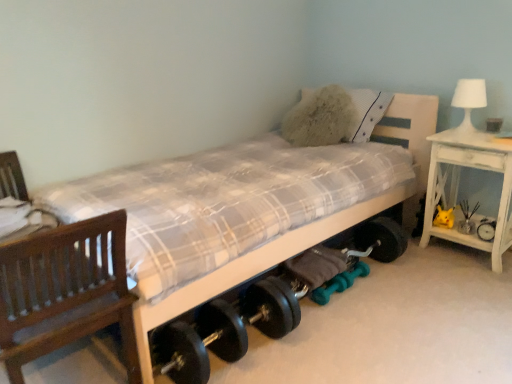
Question: From a real-world perspective, is yellow plush toy at right located higher than teal rubber dumbbell at lower center, the first dumbbell from the right?

Choices:
 (A) yes
 (B) no

Answer: (A)

Question: Considering the relative positions of yellow plush toy at right and teal rubber dumbbell at lower center, the first dumbbell from the right, in the image provided, is yellow plush toy at right to the right of teal rubber dumbbell at lower center, the first dumbbell from the right, from the viewer's perspective?

Choices:
 (A) yes
 (B) no

Answer: (A)

Question: Considering the relative positions of yellow plush toy at right and teal rubber dumbbell at lower center, which appears as the 2th dumbbell when viewed from the left, in the image provided, is yellow plush toy at right behind teal rubber dumbbell at lower center, which appears as the 2th dumbbell when viewed from the left,?

Choices:
 (A) no
 (B) yes

Answer: (B)

Question: Is yellow plush toy at right next to teal rubber dumbbell at lower center, which appears as the 2th dumbbell when viewed from the left, and touching it?

Choices:
 (A) yes
 (B) no

Answer: (B)

Question: Is yellow plush toy at right to the left of teal rubber dumbbell at lower center, which appears as the 2th dumbbell when viewed from the left, from the viewer's perspective?

Choices:
 (A) yes
 (B) no

Answer: (B)

Question: Would you say yellow plush toy at right is inside or outside brown wooden chair at left?

Choices:
 (A) outside
 (B) inside

Answer: (A)

Question: Considering the positions of yellow plush toy at right and brown wooden chair at left in the image, is yellow plush toy at right wider or thinner than brown wooden chair at left?

Choices:
 (A) thin
 (B) wide

Answer: (A)

Question: In terms of height, does yellow plush toy at right look taller or shorter compared to brown wooden chair at left?

Choices:
 (A) short
 (B) tall

Answer: (A)

Question: From a real-world perspective, is yellow plush toy at right physically located above or below brown wooden chair at left?

Choices:
 (A) above
 (B) below

Answer: (B)

Question: From a real-world perspective, is teal rubber dumbbell at lower center, which appears as the 2th dumbbell when viewed from the left, physically located above or below brown wooden chair at left?

Choices:
 (A) above
 (B) below

Answer: (B)

Question: Is point click(x=356, y=261) closer or farther from the camera than point click(x=51, y=322)?

Choices:
 (A) closer
 (B) farther

Answer: (B)

Question: From the image's perspective, is teal rubber dumbbell at lower center, which appears as the 2th dumbbell when viewed from the left, positioned above or below brown wooden chair at left?

Choices:
 (A) below
 (B) above

Answer: (A)

Question: Visually, is teal rubber dumbbell at lower center, the first dumbbell from the right, positioned to the left or to the right of brown wooden chair at left?

Choices:
 (A) right
 (B) left

Answer: (A)

Question: Looking at their shapes, would you say teal rubber dumbbell at lower center, marked as the first dumbbell in a left-to-right arrangement, is wider or thinner than yellow plush toy at right?

Choices:
 (A) wide
 (B) thin

Answer: (B)

Question: Is teal rubber dumbbell at lower center, placed as the 2th dumbbell when sorted from right to left, taller or shorter than yellow plush toy at right?

Choices:
 (A) tall
 (B) short

Answer: (B)